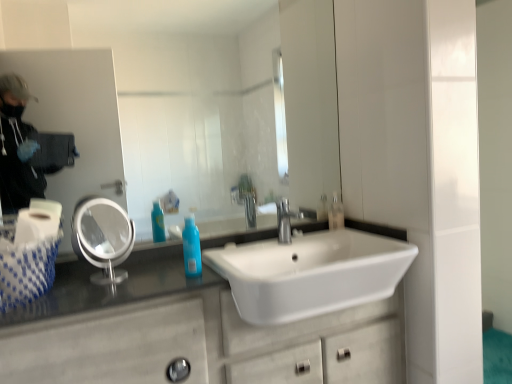
The height and width of the screenshot is (384, 512). What do you see at coordinates (191, 247) in the screenshot?
I see `blue glossy bottle at center` at bounding box center [191, 247].

The image size is (512, 384). What do you see at coordinates (183, 106) in the screenshot?
I see `white glossy mirror at upper center, which is the 2th mirror in left-to-right order` at bounding box center [183, 106].

Locate an element on the screen. Image resolution: width=512 pixels, height=384 pixels. white glossy sink at center is located at coordinates 310,273.

What is the approximate height of white woven tissue at left?

It is 5.83 inches.

The image size is (512, 384). I want to click on translucent plastic soap dispenser at upper right, so click(335, 213).

Can you confirm if translucent plastic soap dispenser at upper right is bigger than white woven tissue at left?

Incorrect, translucent plastic soap dispenser at upper right is not larger than white woven tissue at left.

Is translucent plastic soap dispenser at upper right further to camera compared to white woven tissue at left?

Yes, it is.

Is translucent plastic soap dispenser at upper right oriented away from white woven tissue at left?

No, translucent plastic soap dispenser at upper right's orientation is not away from white woven tissue at left.

Can you confirm if translucent plastic soap dispenser at upper right is positioned to the left of white woven tissue at left?

Incorrect, translucent plastic soap dispenser at upper right is not on the left side of white woven tissue at left.

How different are the orientations of white glossy mirror at upper center, the first mirror in the right-to-left sequence, and white marble bathroom cabinet at lower left in degrees?

0.218 degrees separate the facing orientations of white glossy mirror at upper center, the first mirror in the right-to-left sequence, and white marble bathroom cabinet at lower left.

Is white glossy mirror at upper center, the first mirror in the right-to-left sequence, next to white marble bathroom cabinet at lower left?

white glossy mirror at upper center, the first mirror in the right-to-left sequence, and white marble bathroom cabinet at lower left are clearly separated.

Is white glossy mirror at upper center, the first mirror in the right-to-left sequence, closer to the viewer compared to white marble bathroom cabinet at lower left?

No, it is behind white marble bathroom cabinet at lower left.

Find the location of a particular element. bathroom cabinet located on the right of white glossy mirror at upper center, which is the 2th mirror in left-to-right order is located at coordinates (189, 336).

Is translucent plastic soap dispenser at upper right inside the boundaries of blue glossy bottle at center, or outside?

translucent plastic soap dispenser at upper right is located beyond the bounds of blue glossy bottle at center.

Looking at the image, does translucent plastic soap dispenser at upper right seem bigger or smaller compared to blue glossy bottle at center?

Considering their sizes, translucent plastic soap dispenser at upper right takes up less space than blue glossy bottle at center.

Is translucent plastic soap dispenser at upper right at the left side of blue glossy bottle at center?

In fact, translucent plastic soap dispenser at upper right is to the right of blue glossy bottle at center.

Who is shorter, translucent plastic soap dispenser at upper right or blue glossy bottle at center?

translucent plastic soap dispenser at upper right is shorter.

From the image's perspective, between white woven tissue at left and blue glossy bottle at center, who is located below?

blue glossy bottle at center appears lower in the image.

Is white woven tissue at left thinner than blue glossy bottle at center?

No.

Does white woven tissue at left touch blue glossy bottle at center?

No, white woven tissue at left is not making contact with blue glossy bottle at center.

Looking at this image, which object is positioned more to the right, white woven tissue at left or blue glossy bottle at center?

blue glossy bottle at center is more to the right.

Is clear plastic mirror at left, the second mirror in the right-to-left sequence, to the left of white glossy mirror at upper center, which is the 2th mirror in left-to-right order, from the viewer's perspective?

Indeed, clear plastic mirror at left, the second mirror in the right-to-left sequence, is positioned on the left side of white glossy mirror at upper center, which is the 2th mirror in left-to-right order.

The image size is (512, 384). Find the location of `mirror above the clear plastic mirror at left, the first mirror from the left (from the image's perspective)`. mirror above the clear plastic mirror at left, the first mirror from the left (from the image's perspective) is located at coordinates (183, 106).

What's the angular difference between clear plastic mirror at left, the first mirror from the left, and white glossy mirror at upper center, which is the 2th mirror in left-to-right order,'s facing directions?

36.1 degrees.

Does clear plastic mirror at left, the second mirror in the right-to-left sequence, have a greater width compared to white glossy mirror at upper center, the first mirror in the right-to-left sequence?

Correct, the width of clear plastic mirror at left, the second mirror in the right-to-left sequence, exceeds that of white glossy mirror at upper center, the first mirror in the right-to-left sequence.

Which object is positioned more to the right, white woven tissue at left or white marble bathroom cabinet at lower left?

Positioned to the right is white marble bathroom cabinet at lower left.

Is white woven tissue at left inside or outside of white marble bathroom cabinet at lower left?

white woven tissue at left is located beyond the bounds of white marble bathroom cabinet at lower left.

In the image, is white woven tissue at left positioned in front of or behind white marble bathroom cabinet at lower left?

white woven tissue at left is behind white marble bathroom cabinet at lower left.

From a real-world perspective, which object rests below the other?

white marble bathroom cabinet at lower left.

From the picture: Is white marble bathroom cabinet at lower left facing away from blue glossy bottle at center?

No, white marble bathroom cabinet at lower left is not facing the opposite direction of blue glossy bottle at center.

Between white marble bathroom cabinet at lower left and blue glossy bottle at center, which one has larger size?

With larger size is white marble bathroom cabinet at lower left.

From the image's perspective, which is below, white marble bathroom cabinet at lower left or blue glossy bottle at center?

From the image's view, white marble bathroom cabinet at lower left is below.

The width and height of the screenshot is (512, 384). I want to click on toiletry behind the white woven tissue at left, so click(335, 213).

The height and width of the screenshot is (384, 512). I want to click on bathroom cabinet on the right of the white glossy mirror at upper center, which is the 2th mirror in left-to-right order, so click(189, 336).

Which object lies nearer to the anchor point white glossy sink at center, white woven tissue at left or silver metallic faucet at center?

Among the two, silver metallic faucet at center is located nearer to white glossy sink at center.

When comparing their distances from clear plastic mirror at left, the second mirror in the right-to-left sequence, does white marble bathroom cabinet at lower left or white woven tissue at left seem further?

white marble bathroom cabinet at lower left lies further to clear plastic mirror at left, the second mirror in the right-to-left sequence, than the other object.

From the image, which object appears to be farther from blue glossy bottle at center, white glossy sink at center or white marble bathroom cabinet at lower left?

white glossy sink at center lies further to blue glossy bottle at center than the other object.

Which object lies nearer to the anchor point silver metallic faucet at center, white glossy mirror at upper center, which is the 2th mirror in left-to-right order, or white glossy sink at center?

white glossy sink at center is closer to silver metallic faucet at center.

Based on their spatial positions, is clear plastic mirror at left, the second mirror in the right-to-left sequence, or white marble bathroom cabinet at lower left closer to white woven tissue at left?

clear plastic mirror at left, the second mirror in the right-to-left sequence.

Considering their positions, is white woven tissue at left positioned closer to white marble bathroom cabinet at lower left than white glossy mirror at upper center, the first mirror in the right-to-left sequence?

Among the two, white woven tissue at left is located nearer to white marble bathroom cabinet at lower left.

Estimate the real-world distances between objects in this image. Which object is closer to clear plastic mirror at left, the first mirror from the left, white marble bathroom cabinet at lower left or white glossy sink at center?

The object closer to clear plastic mirror at left, the first mirror from the left, is white marble bathroom cabinet at lower left.

Looking at the image, which one is located further to white glossy mirror at upper center, the first mirror in the right-to-left sequence, translucent plastic soap dispenser at upper right or blue glossy bottle at center?

blue glossy bottle at center lies further to white glossy mirror at upper center, the first mirror in the right-to-left sequence, than the other object.

Where is `tap between clear plastic mirror at left, the first mirror from the left, and white glossy sink at center from left to right`? tap between clear plastic mirror at left, the first mirror from the left, and white glossy sink at center from left to right is located at coordinates (285, 220).

At what (x,y) coordinates should I click in order to perform the action: click on cleaning product between white glossy mirror at upper center, the first mirror in the right-to-left sequence, and translucent plastic soap dispenser at upper right from left to right. Please return your answer as a coordinate pair (x, y). The width and height of the screenshot is (512, 384). Looking at the image, I should click on (191, 247).

In order to click on toilet paper that lies between white glossy mirror at upper center, which is the 2th mirror in left-to-right order, and clear plastic mirror at left, the second mirror in the right-to-left sequence, from top to bottom in this screenshot , I will do `click(38, 221)`.

At what (x,y) coordinates should I click in order to perform the action: click on mirror between clear plastic mirror at left, the first mirror from the left, and translucent plastic soap dispenser at upper right from left to right. Please return your answer as a coordinate pair (x, y). The image size is (512, 384). Looking at the image, I should click on (183, 106).